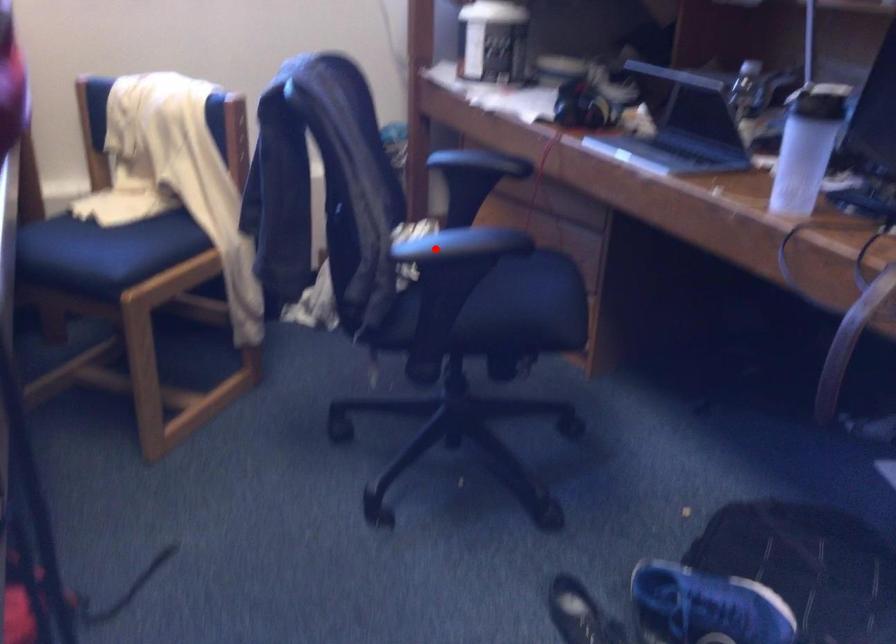
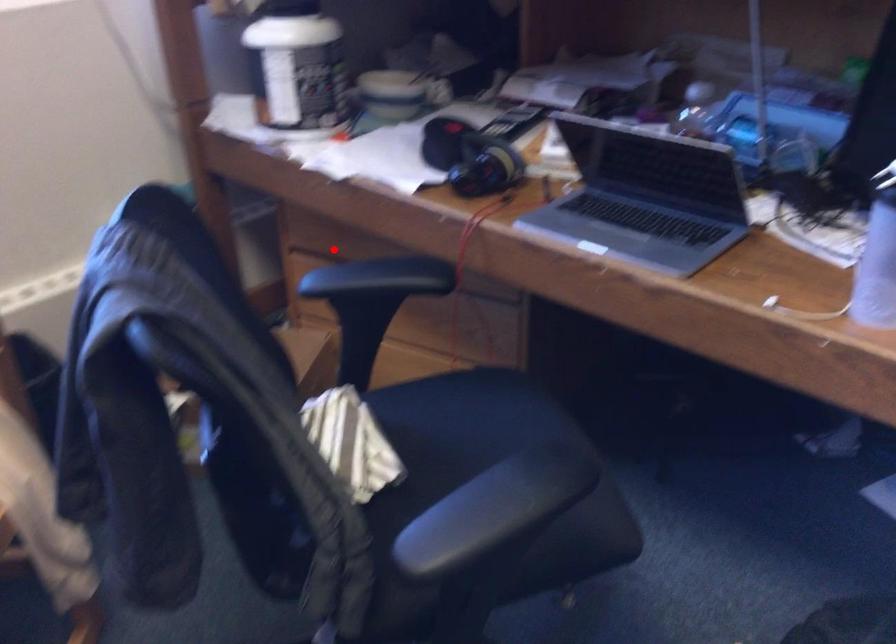
I am providing you with two images of the same scene from different viewpoints. A red point is marked on the first image and another point is marked on the second image. Do the highlighted points in image1 and image2 indicate the same real-world spot?

No